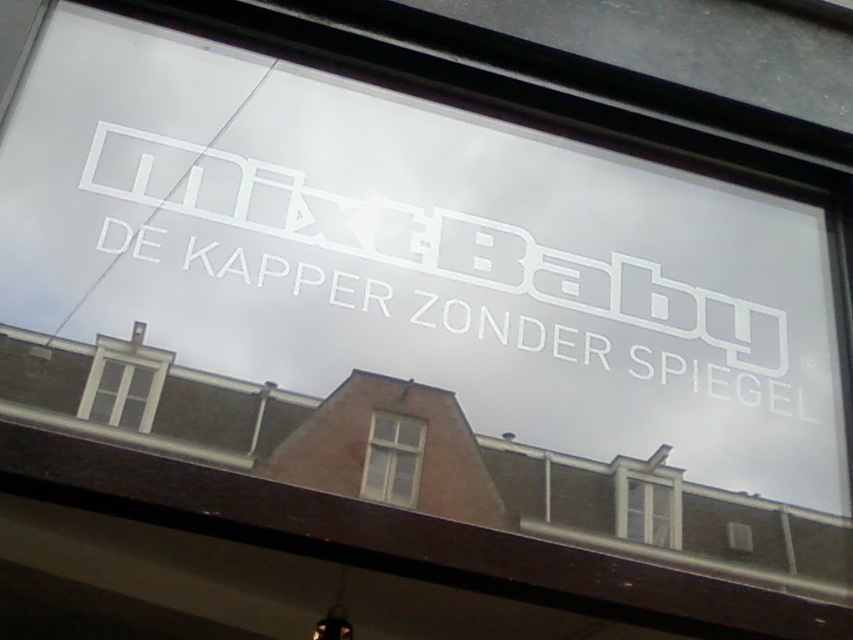
Does white glass window at lower left appear under white wooden window at center?

No.

Identify the location of white glass window at lower left. (125, 381).

Does point (80, 413) come closer to viewer compared to point (386, 500)?

Yes.

Identify the location of white glass window at lower left. The image size is (853, 640). (125, 381).

Does white wooden window at center appear on the right side of clear glass window at center?

Incorrect, white wooden window at center is not on the right side of clear glass window at center.

Describe the element at coordinates (392, 460) in the screenshot. I see `white wooden window at center` at that location.

The width and height of the screenshot is (853, 640). In order to click on white wooden window at center in this screenshot , I will do `click(392, 460)`.

Does white glass window at lower left have a larger size compared to clear glass window at center?

Yes.

Where is `white glass window at lower left`? white glass window at lower left is located at coordinates (125, 381).